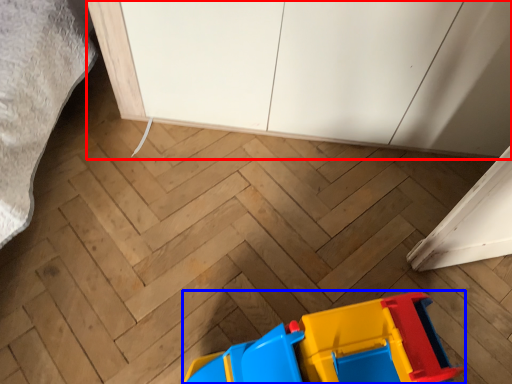
Question: Which of the following is the closest to the observer, cabinetry (highlighted by a red box) or toy (highlighted by a blue box)?

Choices:
 (A) cabinetry
 (B) toy

Answer: (B)